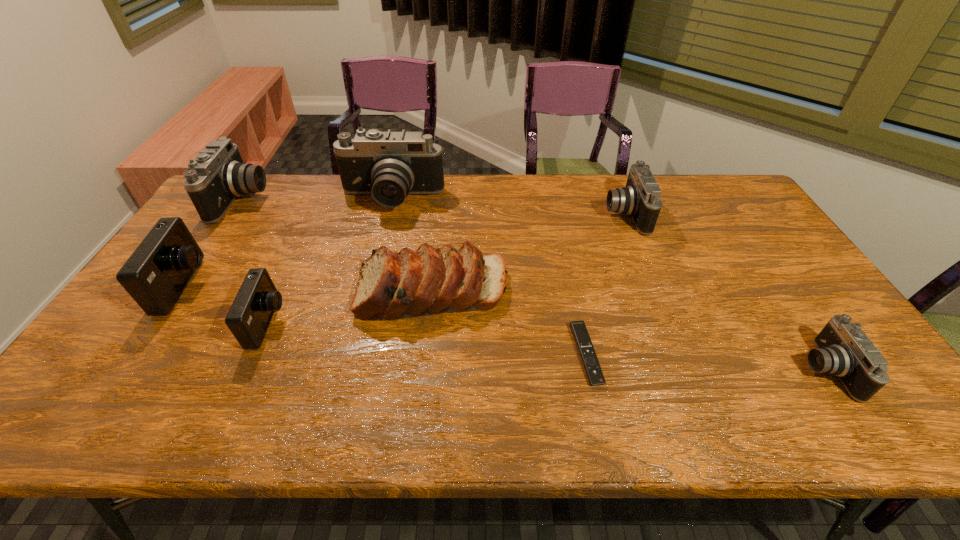
The width and height of the screenshot is (960, 540). In order to click on vacant point located between the remote control and the bread in this screenshot , I will do pyautogui.click(x=510, y=322).

Identify the location of free space between the second biggest black camera and the smaller blue camera. The image size is (960, 540). (255, 261).

You are a GUI agent. You are given a task and a screenshot of the screen. Output one action in this format:
    pyautogui.click(x=<x>, y=<y>)
    Task: Click on the object that stands as the second closest to the bread
    This screenshot has width=960, height=540.
    Given the screenshot: What is the action you would take?
    pyautogui.click(x=248, y=319)

Point out which object is positioned as the third nearest to the rightmost object. Please provide its 2D coordinates. Your answer should be formatted as a tuple, i.e. [(x, y)], where the tuple contains the x and y coordinates of a point satisfying the conditions above.

[(391, 285)]

Identify which camera is the nearest to the smaller blue camera. Please provide its 2D coordinates. Your answer should be formatted as a tuple, i.e. [(x, y)], where the tuple contains the x and y coordinates of a point satisfying the conditions above.

[(155, 275)]

Where is `camera that can be found as the second closest to the bread`? This screenshot has height=540, width=960. camera that can be found as the second closest to the bread is located at coordinates (389, 165).

The image size is (960, 540). Find the location of `black camera identified as the third closest to the rightmost object`. black camera identified as the third closest to the rightmost object is located at coordinates (217, 176).

Select which black camera is the third closest to the smaller blue camera. Please provide its 2D coordinates. Your answer should be formatted as a tuple, i.e. [(x, y)], where the tuple contains the x and y coordinates of a point satisfying the conditions above.

[(640, 199)]

This screenshot has height=540, width=960. I want to click on free region that satisfies the following two spatial constraints: 1. on the front-facing side of the second tallest camera; 2. on the back side of the third object from right to left, so click(137, 354).

Find the location of `vacant region that satisfies the following two spatial constraints: 1. on the front side of the bread; 2. on the front-facing side of the smaller blue camera`. vacant region that satisfies the following two spatial constraints: 1. on the front side of the bread; 2. on the front-facing side of the smaller blue camera is located at coordinates (429, 323).